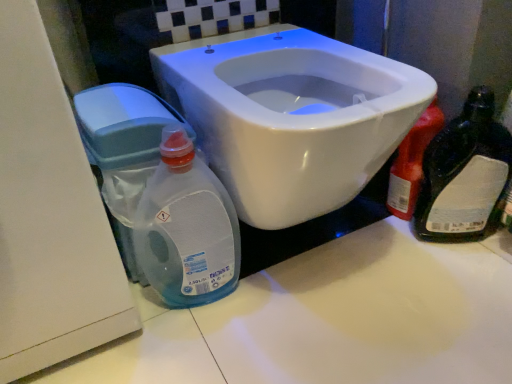
You are a GUI agent. You are given a task and a screenshot of the screen. Output one action in this format:
    pyautogui.click(x=<x>, y=<y>)
    Task: Click on the free space on the front side of translucent plastic bottle at right
    
    Given the screenshot: What is the action you would take?
    pyautogui.click(x=461, y=279)